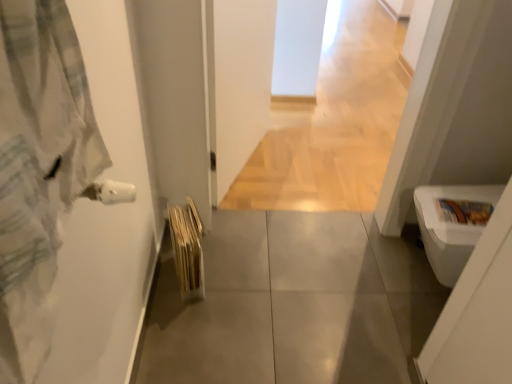
Locate an element on the screen. The height and width of the screenshot is (384, 512). vacant space behind beige textured bath towel at lower left is located at coordinates (216, 246).